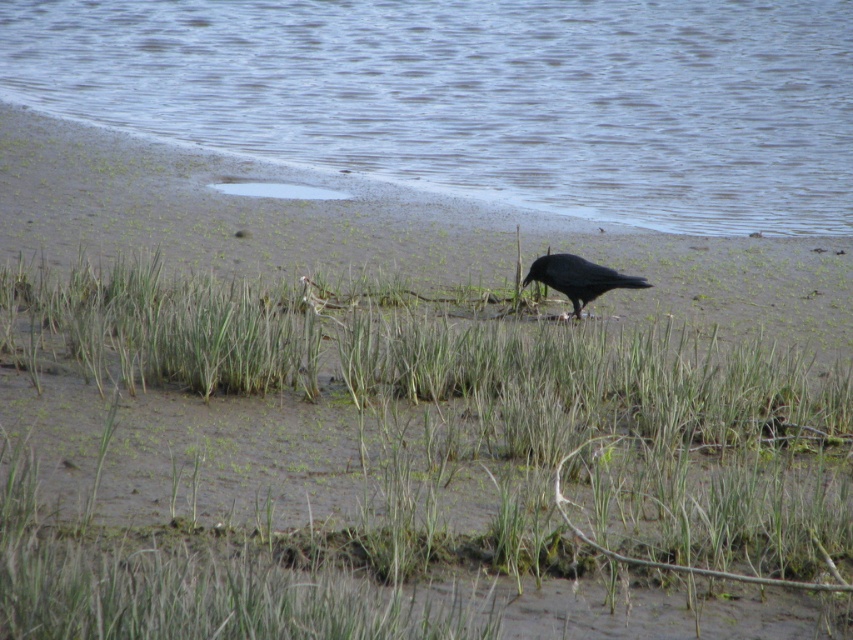
Find the location of a particular element. green grass at center is located at coordinates (386, 458).

Who is more distant from viewer, [109,499] or [578,282]?

The point [578,282] is behind.

This screenshot has height=640, width=853. Find the location of `green grass at center`. green grass at center is located at coordinates (386, 458).

Is point (587, 504) behind point (828, 104)?

No.

Does point (10, 493) lie behind point (151, 49)?

No, (10, 493) is closer to viewer.

Find the location of a particular element. green grass at center is located at coordinates (386, 458).

Is clear water at lower left to the right of shiny black crow at center from the viewer's perspective?

Correct, you'll find clear water at lower left to the right of shiny black crow at center.

Is point (238, 90) in front of point (573, 260)?

No, (238, 90) is further to viewer.

Find the location of a particular element. clear water at lower left is located at coordinates point(480,97).